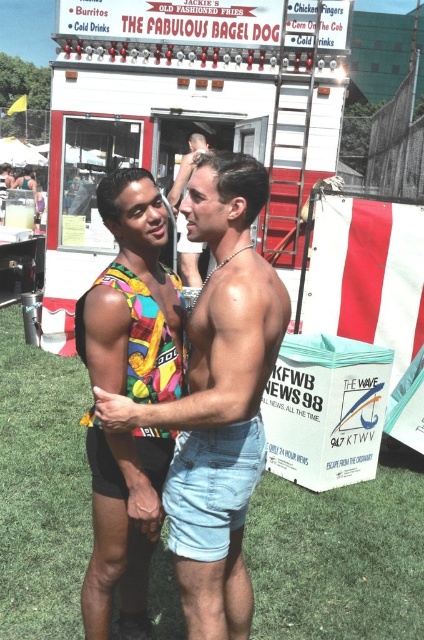
You are a photographer trying to capture the multicolored fabric tank top at center in the image. Given that the camera is focused at point (217, 397), will the tank top be in focus?

Yes, the point (217, 397) corresponds to the multicolored fabric tank top at center, so the tank top will be in focus.

You are a photographer at the festival and want to capture a photo where the multicolored fabric tank top at center and denim shorts at center are both visible. Which object should you position closer to the left side of the frame to ensure both are included?

The multicolored fabric tank top at center should be positioned closer to the left side of the frame since it is already to the left of denim shorts at center, ensuring both objects remain visible in the photo.

You are a photographer setting up a tripod in the center of the scene. You need to ensure that both the white plastic food truck at center and the vibrant multicolored fabric bikini top at center are in focus. Given that the food truck is much taller than the bikini top, which object should you adjust your camera angle to prioritize focusing on first to ensure both are in the frame?

Since the white plastic food truck at center is much taller than the vibrant multicolored fabric bikini top at center, you should prioritize focusing on the white plastic food truck at center first to ensure its full height is captured within the frame, allowing the bikini top to naturally fall into the composition.